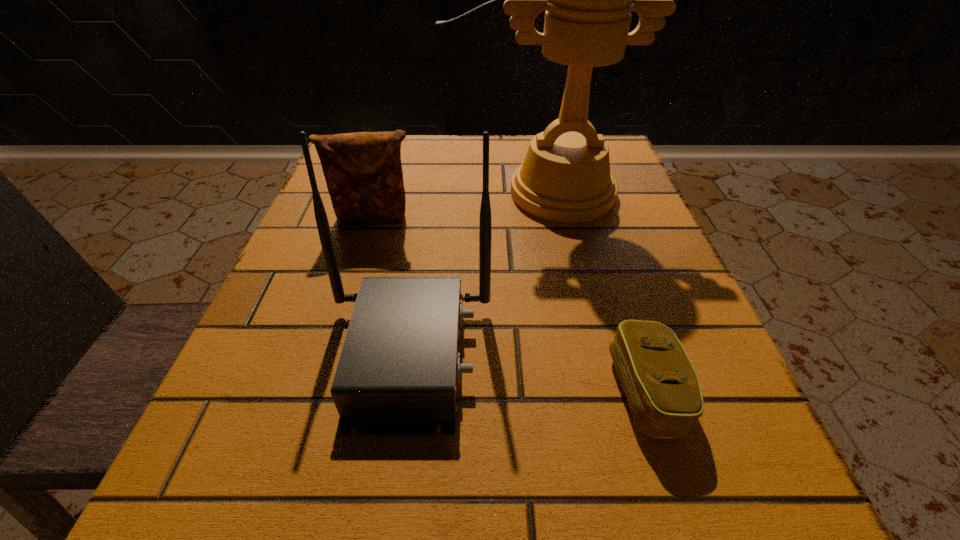
Find the location of `vacant point located between the taller clutch bag and the tallest object`. vacant point located between the taller clutch bag and the tallest object is located at coordinates (468, 206).

I want to click on object that stands as the third closest to the third shortest object, so click(x=565, y=177).

Identify the location of the third closest object relative to the award. The height and width of the screenshot is (540, 960). (661, 385).